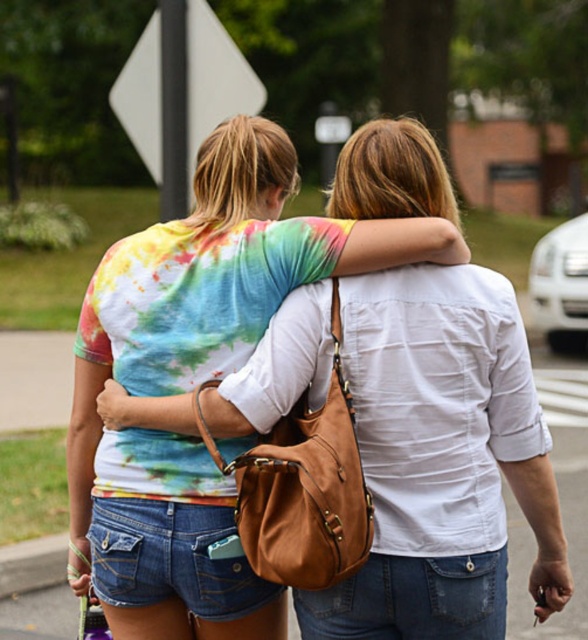
Question: Which of the following is the closest to the observer?

Choices:
 (A) white plastic sign at upper center
 (B) tie-dye fabric shirt at center

Answer: (B)

Question: Which point is farther from the camera taking this photo?

Choices:
 (A) (198, 54)
 (B) (492, 380)

Answer: (A)

Question: Is tie-dye fabric shirt at center positioned at the back of white plastic sign at upper center?

Choices:
 (A) yes
 (B) no

Answer: (B)

Question: In this image, where is tie-dye fabric shirt at center located relative to white plastic sign at upper center?

Choices:
 (A) above
 (B) below

Answer: (B)

Question: Where is tie-dye fabric shirt at center located in relation to white plastic sign at upper center in the image?

Choices:
 (A) below
 (B) above

Answer: (A)